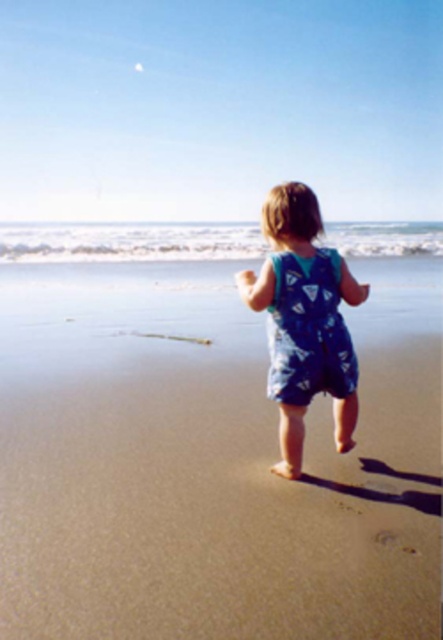
Who is higher up, blue fabric baby at center or blue cotton onesie at center?

blue cotton onesie at center

This screenshot has height=640, width=443. I want to click on blue fabric baby at center, so click(210, 464).